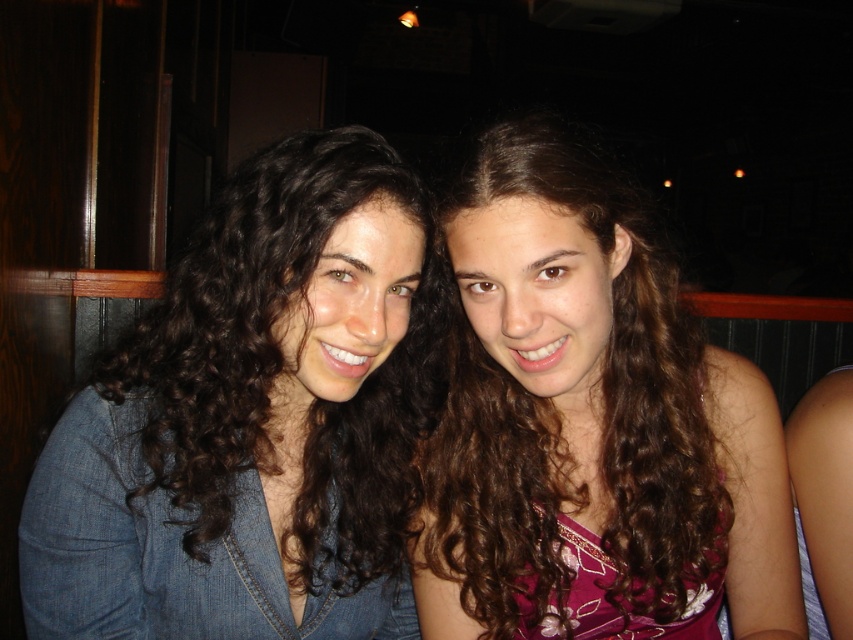
Question: Among these objects, which one is nearest to the camera?

Choices:
 (A) dark brown curly hair at center
 (B) brown curly hair at center

Answer: (A)

Question: Is dark brown curly hair at center thinner than brown curly hair at center?

Choices:
 (A) yes
 (B) no

Answer: (A)

Question: Does dark brown curly hair at center appear on the right side of brown curly hair at center?

Choices:
 (A) no
 (B) yes

Answer: (A)

Question: Which point is closer to the camera?

Choices:
 (A) brown curly hair at center
 (B) dark brown curly hair at center

Answer: (B)

Question: Is dark brown curly hair at center below brown curly hair at center?

Choices:
 (A) yes
 (B) no

Answer: (A)